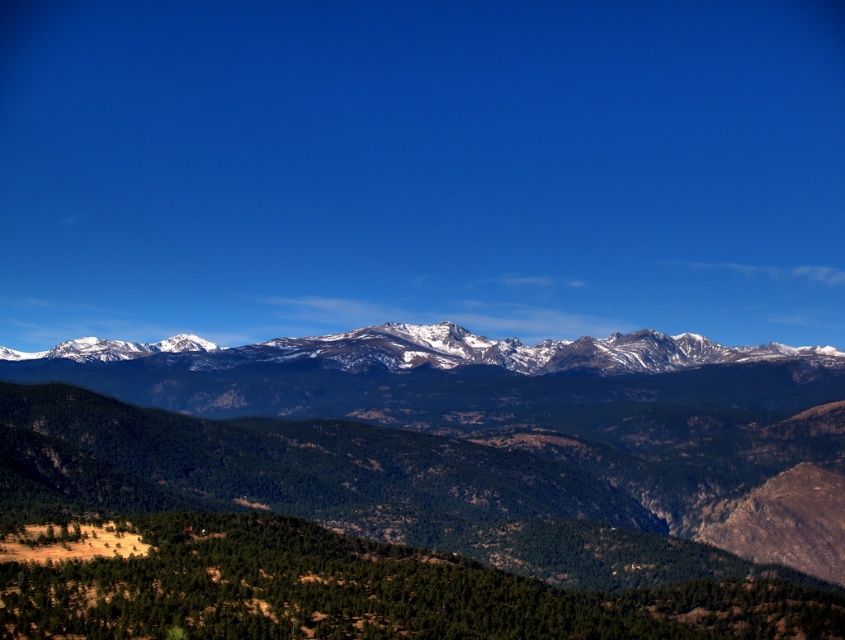
Question: Can you confirm if green textured hillside at lower center is thinner than snowy rocky mountain range at center?

Choices:
 (A) no
 (B) yes

Answer: (B)

Question: From the image, what is the correct spatial relationship of green textured hillside at lower center in relation to snowy rocky mountain range at center?

Choices:
 (A) above
 (B) below

Answer: (B)

Question: Is green textured hillside at lower center to the right of snowy rocky mountain range at center from the viewer's perspective?

Choices:
 (A) yes
 (B) no

Answer: (A)

Question: Among these objects, which one is farthest from the camera?

Choices:
 (A) green textured hillside at lower center
 (B) snowy rocky mountain range at center

Answer: (B)

Question: Which of the following is the farthest from the observer?

Choices:
 (A) (91, 627)
 (B) (202, 342)

Answer: (B)